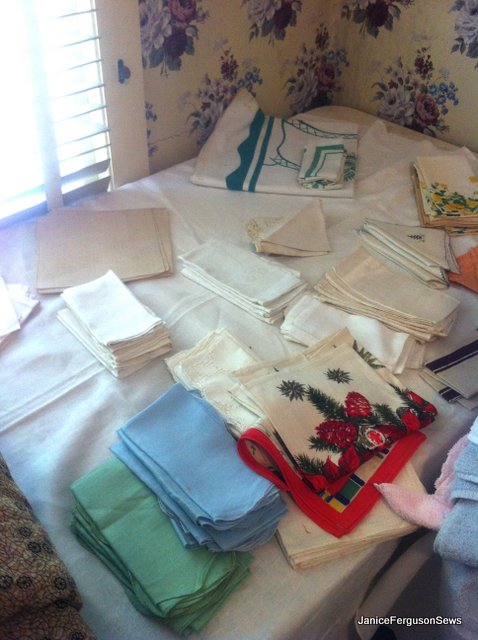
Locate an element on the screen. The image size is (478, 640). floral pattern is located at coordinates (161, 22).